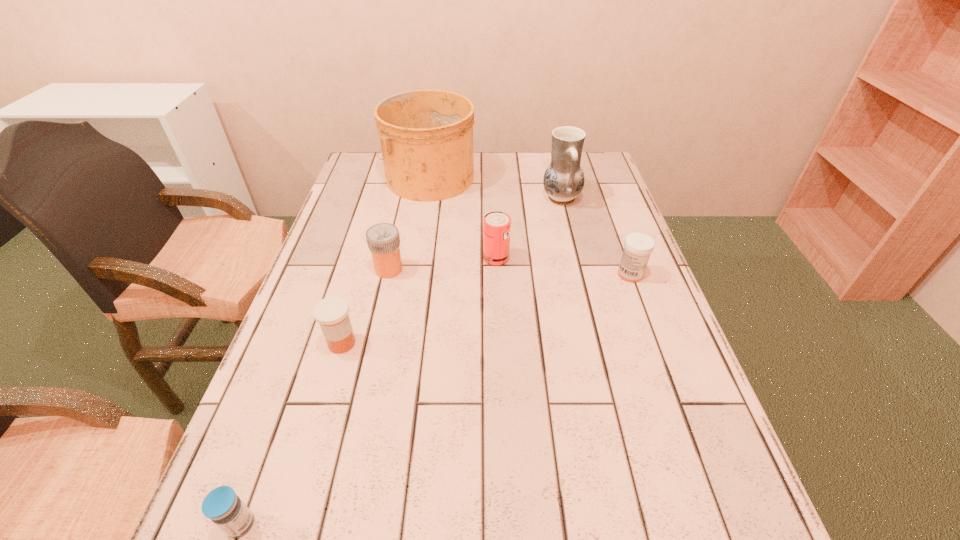
Where is `free space located on the label of the third farthest medicine`? free space located on the label of the third farthest medicine is located at coordinates pyautogui.click(x=535, y=343).

The height and width of the screenshot is (540, 960). Identify the location of free space located on the back of the rightmost object. (618, 241).

Identify the location of vacant space situated on the back of the shortest object. (313, 324).

Find the location of a particular element. bucket that is at the far edge is located at coordinates (426, 136).

What are the coordinates of `pottery that is at the far edge` in the screenshot? It's located at (563, 181).

You are a GUI agent. You are given a task and a screenshot of the screen. Output one action in this format:
    pyautogui.click(x=<x>, y=<y>)
    Task: Click on the object present at the near edge
    The height and width of the screenshot is (540, 960).
    Given the screenshot: What is the action you would take?
    pyautogui.click(x=221, y=505)

Find the location of a particular element. Image resolution: width=960 pixels, height=540 pixels. bucket present at the left edge is located at coordinates [x=426, y=136].

Identify the location of pottery at the right edge. Image resolution: width=960 pixels, height=540 pixels. (563, 181).

Locate an element on the screen. medicine that is positioned at the right edge is located at coordinates (638, 246).

The height and width of the screenshot is (540, 960). What are the coordinates of `object that is at the far left corner` in the screenshot? It's located at (426, 136).